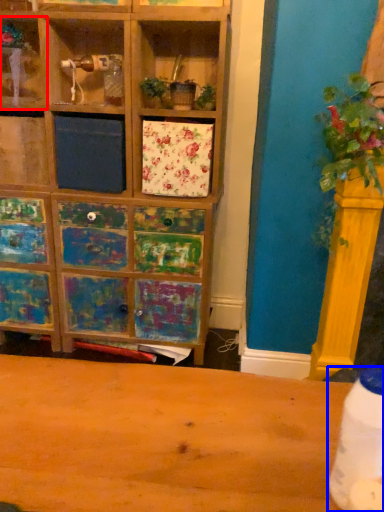
Question: Which object appears farthest to the camera in this image, shelf (highlighted by a red box) or bottle (highlighted by a blue box)?

Choices:
 (A) shelf
 (B) bottle

Answer: (A)